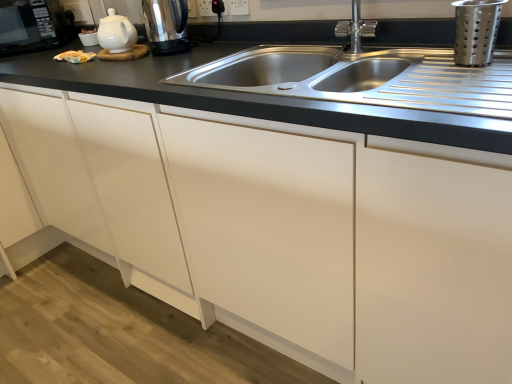
You are a GUI agent. You are given a task and a screenshot of the screen. Output one action in this format:
    pyautogui.click(x=<x>, y=<y>)
    Task: Click on the free space in front of metallic silver strainer at upper right, marked as the first appliance in a front-to-back arrangement
    The image size is (512, 384).
    Given the screenshot: What is the action you would take?
    pyautogui.click(x=476, y=81)